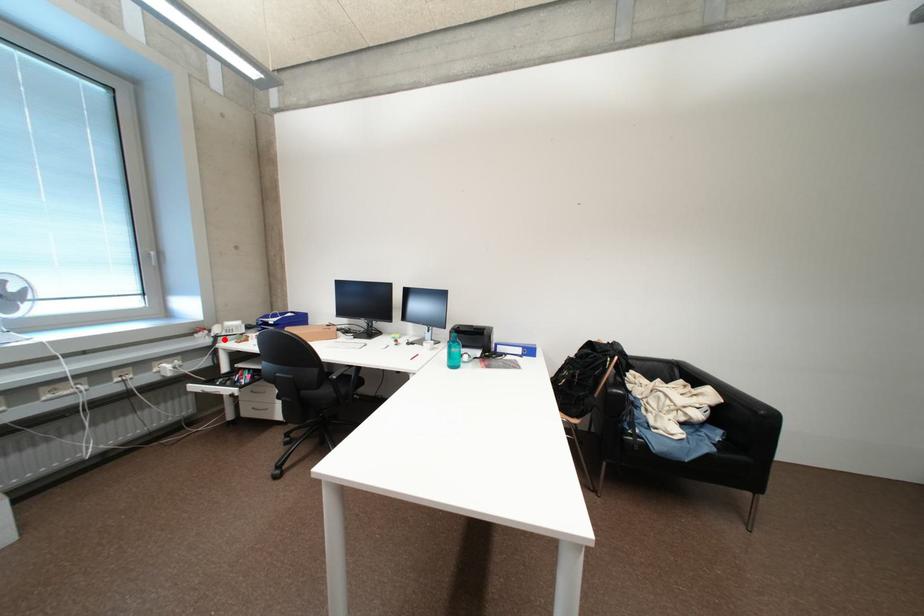
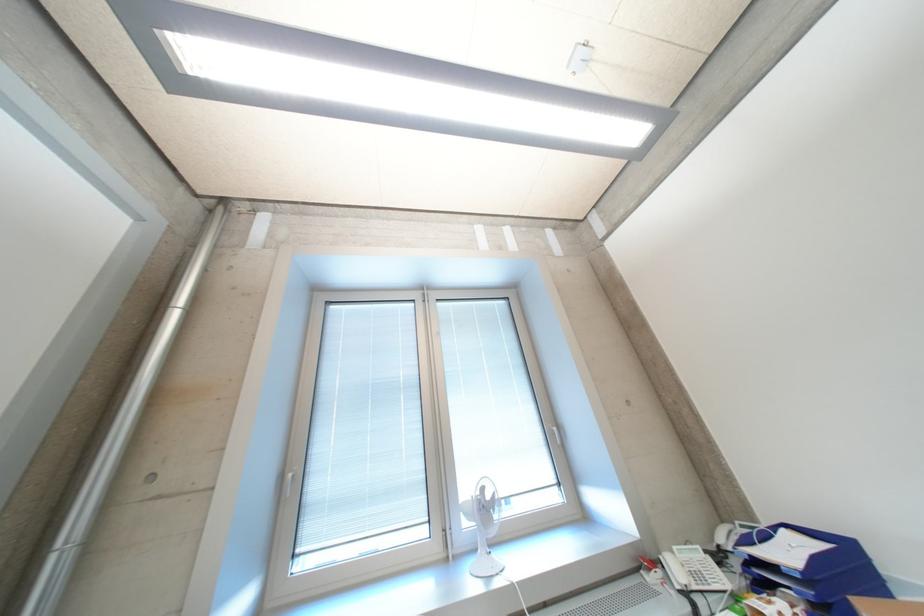
Question: I am providing you with two images of the same scene from different viewpoints. Given a red point in image1, look at the same physical point in image2. Is it:

Choices:
 (A) Closer to the viewpoint
 (B) Farther from the viewpoint

Answer: (A)